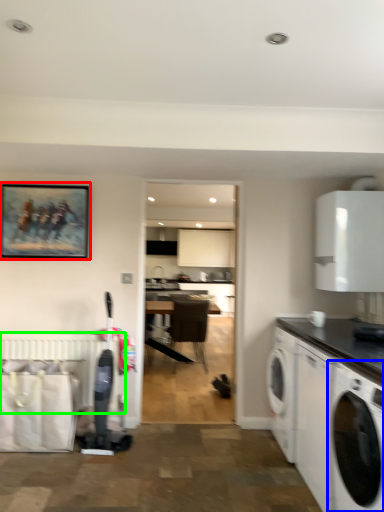
Question: Considering the real-world distances, which object is farthest from picture frame (highlighted by a red box)? washing machine (highlighted by a blue box) or radiator (highlighted by a green box)?

Choices:
 (A) washing machine
 (B) radiator

Answer: (A)